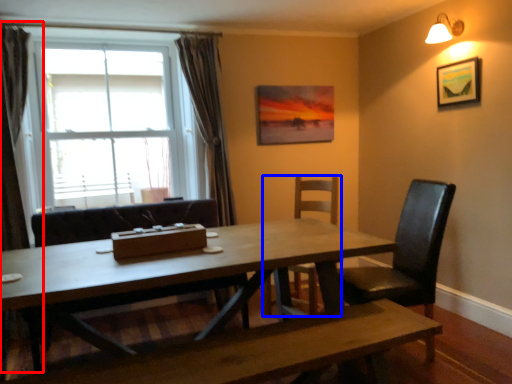
Question: Which object appears closest to the camera in this image, curtain (highlighted by a red box) or chair (highlighted by a blue box)?

Choices:
 (A) curtain
 (B) chair

Answer: (A)